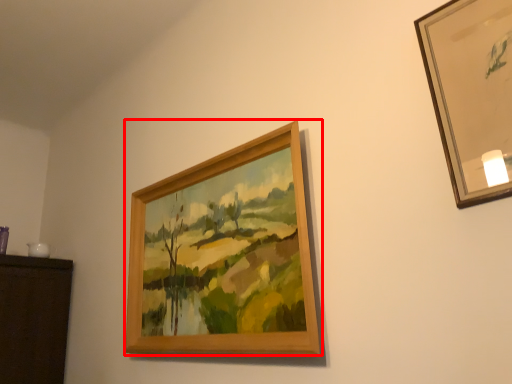
Question: From the image's perspective, considering the relative positions of picture frame (annotated by the red box) and picture frame in the image provided, where is picture frame (annotated by the red box) located with respect to the staircase?

Choices:
 (A) below
 (B) above

Answer: (A)